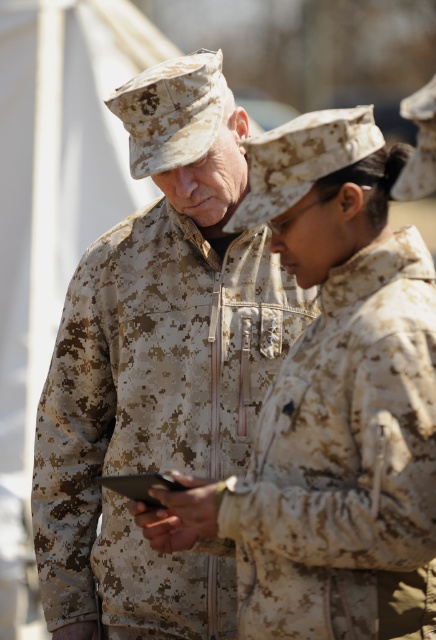
Is camouflage uniform at center wider than camouflage fabric jacket at center?

Yes, camouflage uniform at center is wider than camouflage fabric jacket at center.

Which is in front, point (122, 237) or point (285, 572)?

Point (285, 572)

Is point (102, 381) positioned before point (353, 513)?

No.

Where is `camouflage uniform at center`? This screenshot has width=436, height=640. camouflage uniform at center is located at coordinates (159, 365).